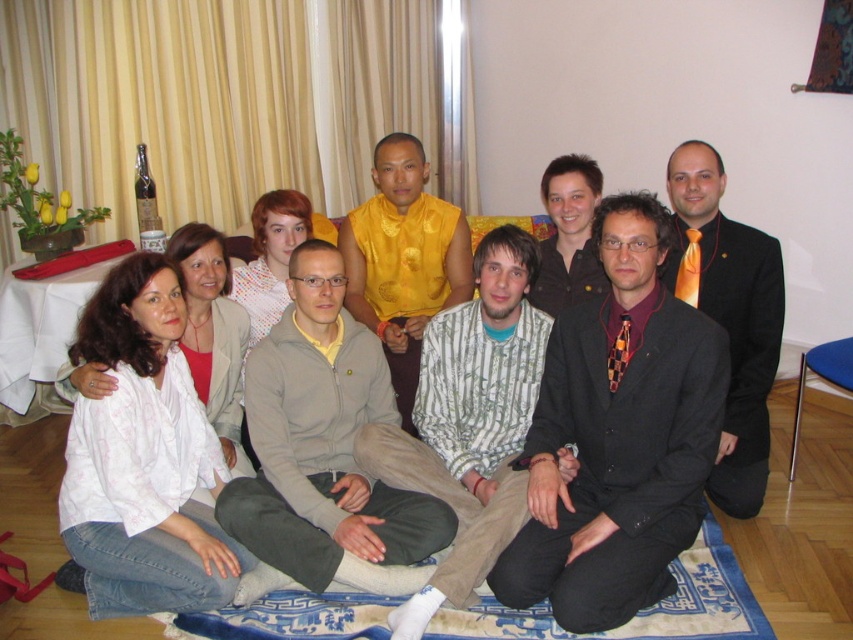
Consider the image. You are a photographer setting up for a group photo. You notice the light gray fleece jacket at center and the striped cotton shirt at center. Which one is positioned higher in the frame?

The light gray fleece jacket at center is positioned higher in the frame than the striped cotton shirt at center.

You are organizing a photo shoot and need to arrange two items on a shelf. The shelf can only hold items up to the width of the striped cotton shirt at center. Can the light gray fleece jacket at center fit on the shelf?

The light gray fleece jacket at center is wider than the striped cotton shirt at center, so it cannot fit on the shelf designed for the shirt.

In the scene shown: You are a photographer setting up for a group photo. You notice the striped cotton shirt at center and the blue woven mat at lower center. Which object is covering the other in the image?

The striped cotton shirt at center is positioned over the blue woven mat at lower center, so it is covering the mat.